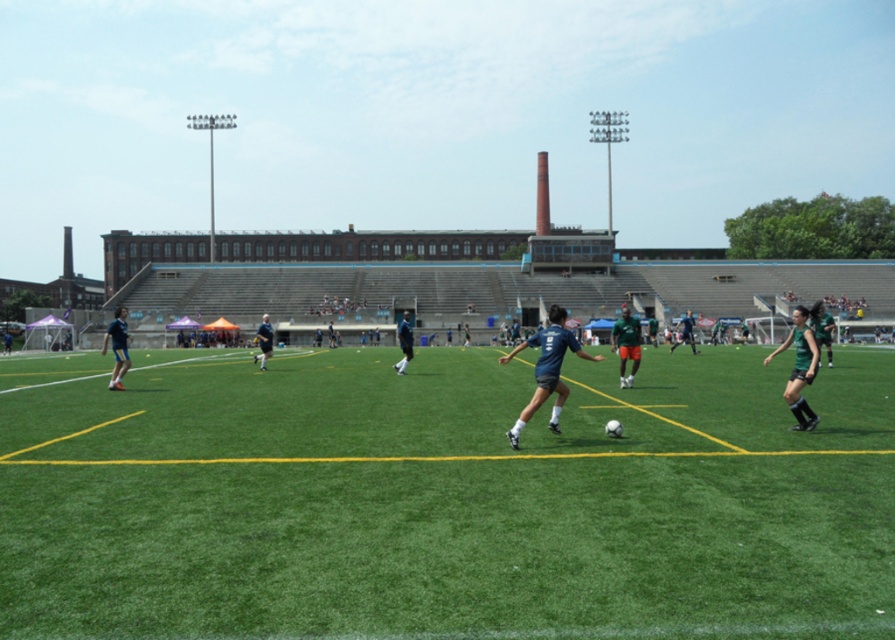
Question: Does green matte shorts at right come behind blue fabric jersey at center?

Choices:
 (A) no
 (B) yes

Answer: (A)

Question: Which object appears farthest from the camera in this image?

Choices:
 (A) blue fabric jersey at center
 (B) green artificial turf at center
 (C) dark blue jersey at center
 (D) matte blue shorts at left

Answer: (A)

Question: Which object appears farthest from the camera in this image?

Choices:
 (A) green matte soccer player at center
 (B) blue fabric jersey at center

Answer: (A)

Question: Which of the following is the closest to the observer?

Choices:
 (A) dark blue jersey at center
 (B) blue fabric shorts at center

Answer: (B)

Question: Is green artificial turf at center positioned in front of green matte soccer player at center?

Choices:
 (A) yes
 (B) no

Answer: (A)

Question: Can you confirm if blue fabric shorts at center is bigger than matte blue shorts at left?

Choices:
 (A) yes
 (B) no

Answer: (B)